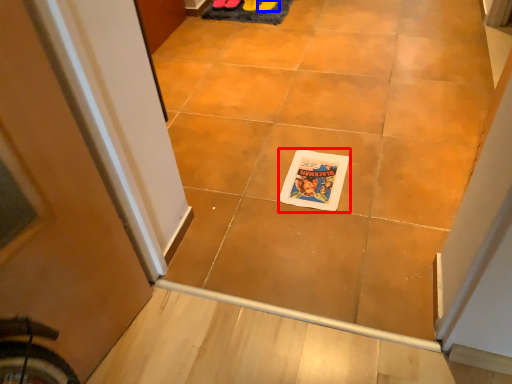
Question: Which point is closer to the camera, comic book character (highlighted by a red box) or footwear (highlighted by a blue box)?

Choices:
 (A) comic book character
 (B) footwear

Answer: (A)